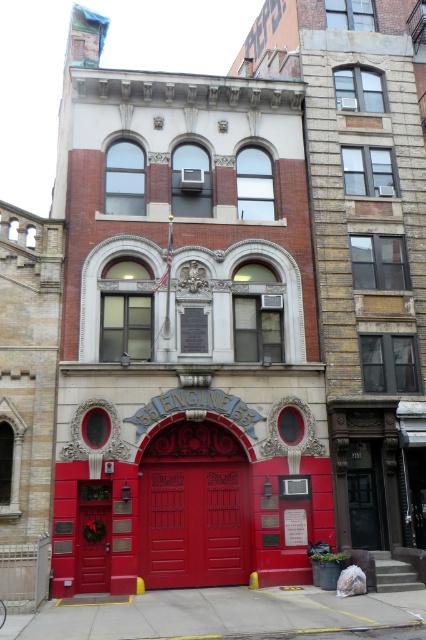
Based on the photo, who is shorter, smooth glossy red doors at center or matte red door at center?

matte red door at center

Describe the element at coordinates (193, 524) in the screenshot. This screenshot has width=426, height=640. I see `smooth glossy red doors at center` at that location.

This screenshot has width=426, height=640. I want to click on smooth glossy red doors at center, so click(193, 524).

Locate an element on the screen. The image size is (426, 640). smooth glossy red doors at center is located at coordinates (193, 524).